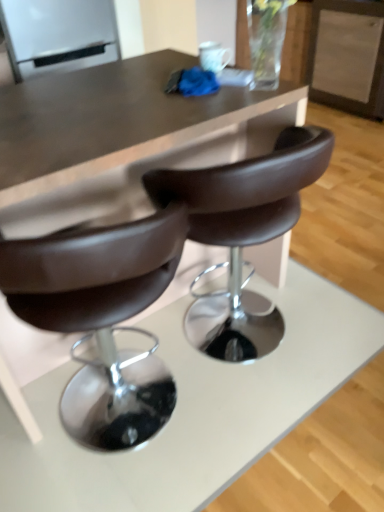
This screenshot has height=512, width=384. Find the location of `free spot in front of brown leather chair at center`. free spot in front of brown leather chair at center is located at coordinates click(x=277, y=438).